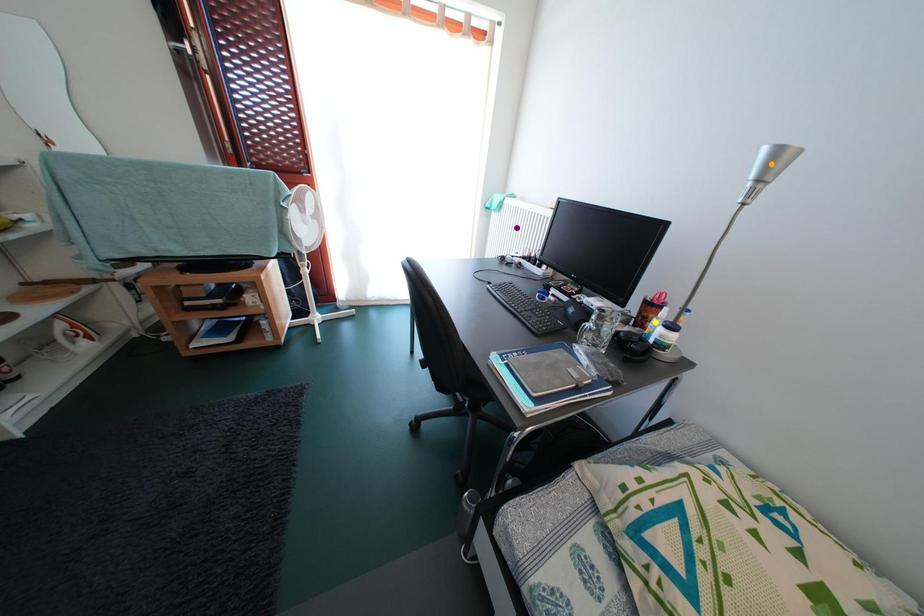
Order these from nearest to farthest:
orange point, purple point, yellow point

purple point
yellow point
orange point